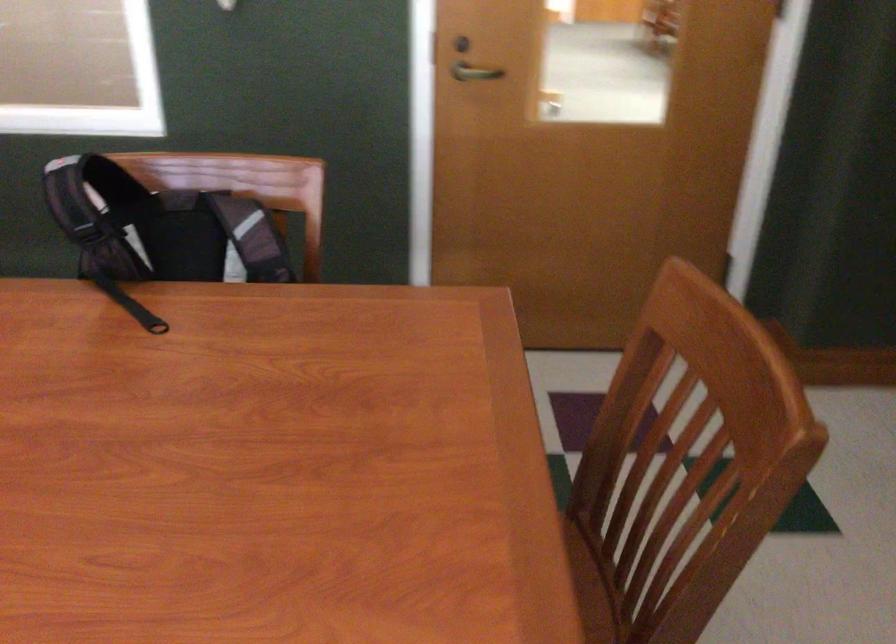
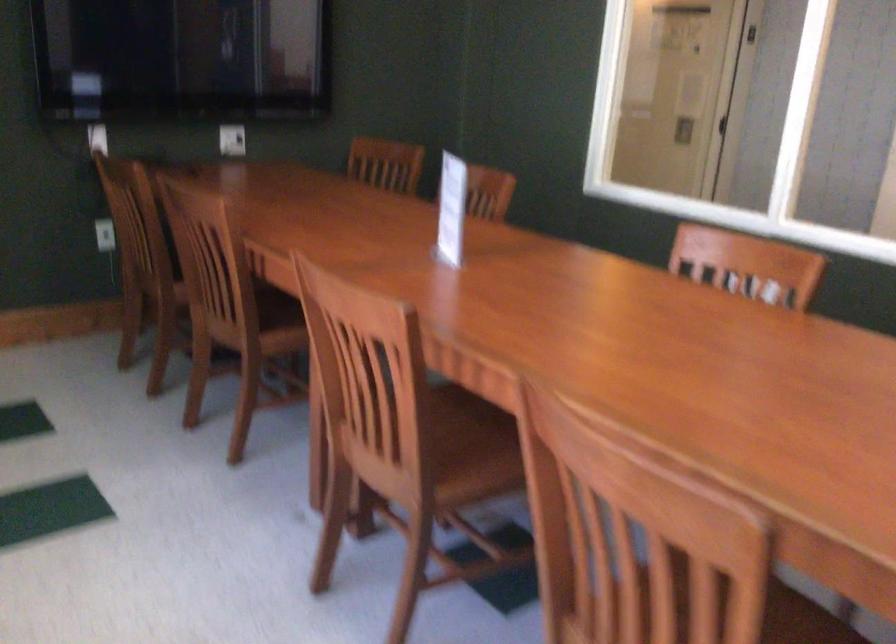
Question: The camera is either moving clockwise (left) or counter-clockwise (right) around the object. The first image is from the beginning of the video and the second image is from the end. Is the camera moving left or right when shooting the video?

Choices:
 (A) Left
 (B) Right

Answer: (B)